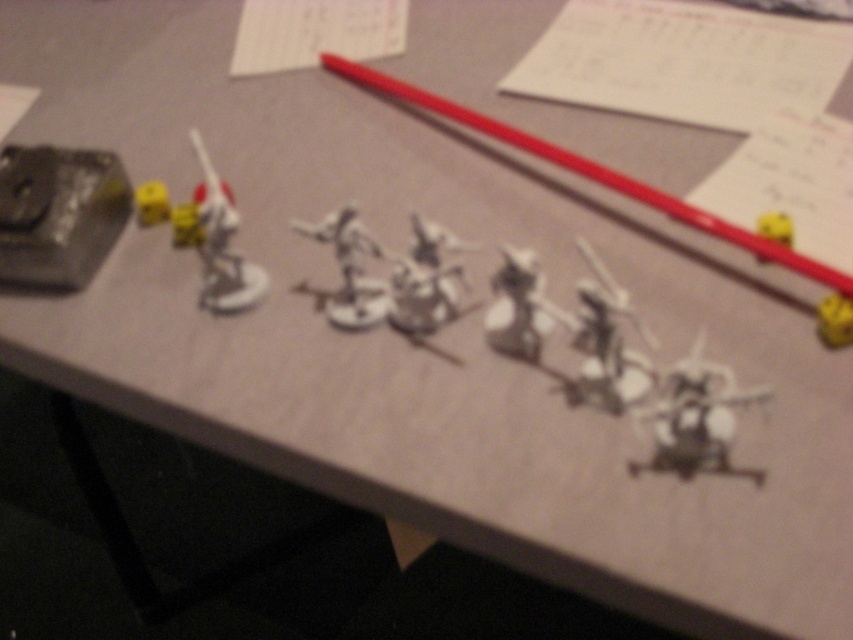
You are a player in a tabletop game and need to place a new figurine between the two points labeled as point (447,312) and point (839,305). Based on their positions, will the new figurine be closer to the camera or further away from it compared to the two points?

The new figurine placed between point (447,312) and point (839,305) will be closer to the camera than point (839,305) but further away than point (447,312) since point (447,312) is closer to the camera than point (839,305).

You are setting up a display for a miniature game. You have two figurines, the satin silver figure at upper left and the yellow matte toy at upper right. Which figurine is taller?

The satin silver figure at upper left is taller than the yellow matte toy at upper right according to the description.

You are setting up a tabletop game and need to place the gray plastic miniature at center and the yellow matte dice at center. Based on the scene description, which object is positioned higher in the image?

The gray plastic miniature at center is positioned above the yellow matte dice at center, so it is higher in the image.